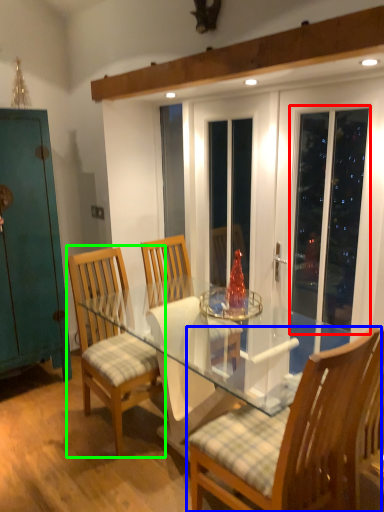
Question: Based on their relative distances, which object is farther from screen door (highlighted by a red box)? Choose from chair (highlighted by a blue box) and chair (highlighted by a green box).

Choices:
 (A) chair
 (B) chair

Answer: (B)